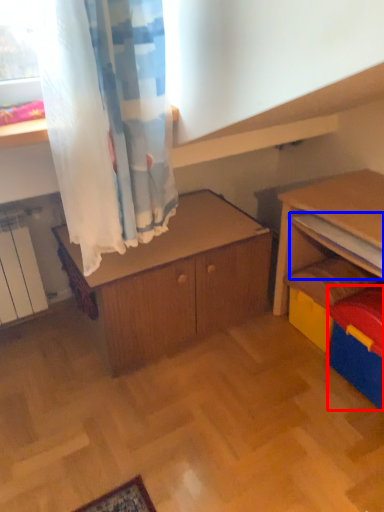
Question: Among these objects, which one is nearest to the camera, storage box (highlighted by a red box) or shelf (highlighted by a blue box)?

Choices:
 (A) storage box
 (B) shelf

Answer: (A)